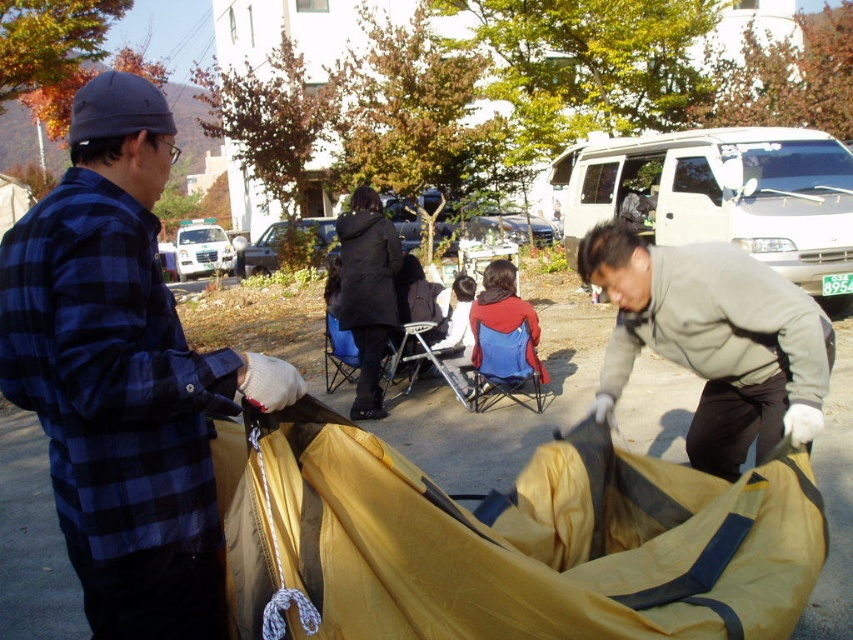
You are a GUI agent. You are given a task and a screenshot of the screen. Output one action in this format:
    pyautogui.click(x=<x>, y=<y>)
    Task: Click on the black matte coat at center
    This screenshot has width=853, height=640.
    Given the screenshot: What is the action you would take?
    pyautogui.click(x=367, y=292)

Does black matte coat at center appear on the left side of red fleece jacket at center?

Correct, you'll find black matte coat at center to the left of red fleece jacket at center.

Is point (351, 260) more distant than point (502, 326)?

Yes, it is behind point (502, 326).

The width and height of the screenshot is (853, 640). Identify the location of black matte coat at center. (367, 292).

Does blue plaid shirt at left appear on the left side of black matte coat at center?

Yes, blue plaid shirt at left is to the left of black matte coat at center.

Is blue plaid shirt at left below black matte coat at center?

Yes.

Looking at this image, who is more forward, [132,362] or [376,198]?

Point [132,362] is in front.

Where is `blue plaid shirt at left`? The width and height of the screenshot is (853, 640). blue plaid shirt at left is located at coordinates (123, 376).

Can you confirm if blue plaid shirt at left is positioned below gray fleece jacket at lower right?

No.

Who is lower down, blue plaid shirt at left or gray fleece jacket at lower right?

gray fleece jacket at lower right is below.

Is point (194, 364) positioned in front of point (601, 397)?

Yes, point (194, 364) is in front of point (601, 397).

This screenshot has height=640, width=853. I want to click on blue plaid shirt at left, so click(x=123, y=376).